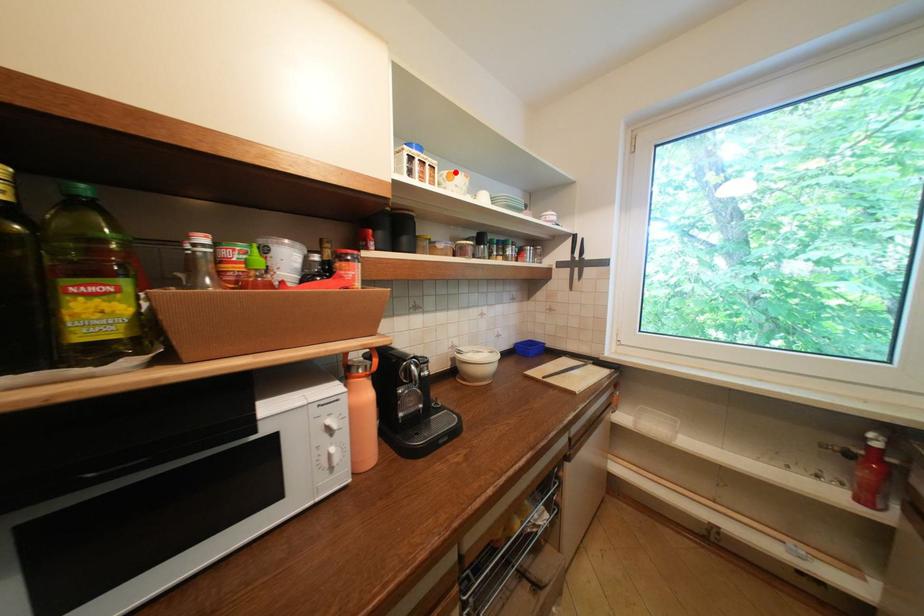
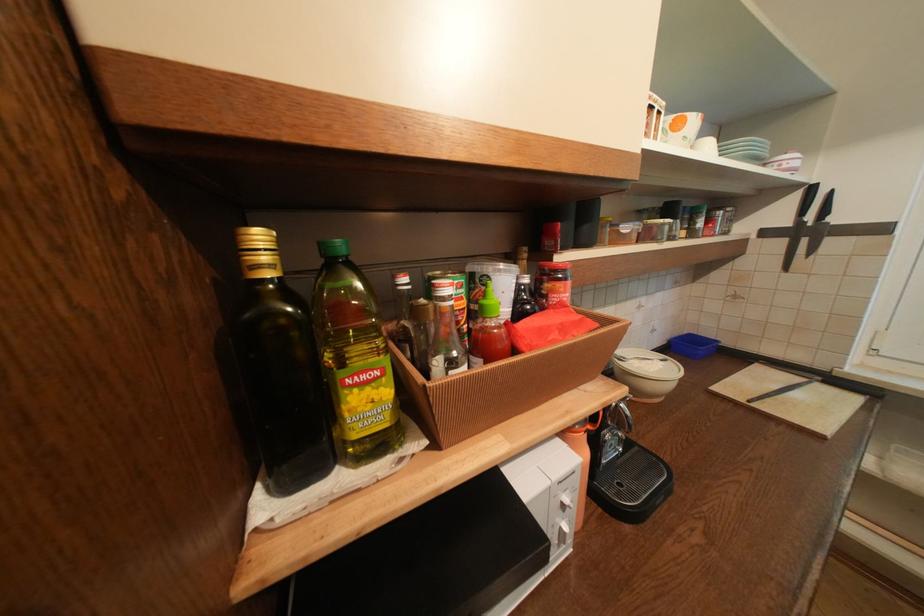
The point at the highlighted location is marked in the first image. Where is the corresponding point in the second image?

(683, 118)